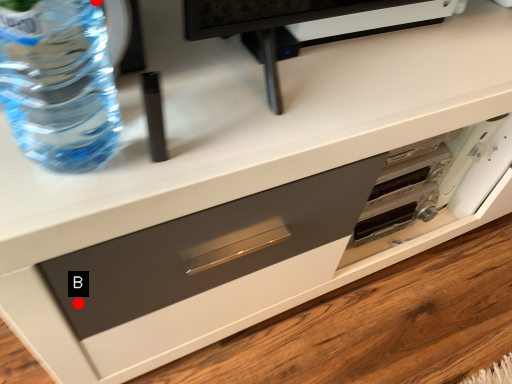
Question: Two points are circled on the image, labeled by A and B beside each circle. Which point is further to the camera?

Choices:
 (A) A is further
 (B) B is further

Answer: (B)